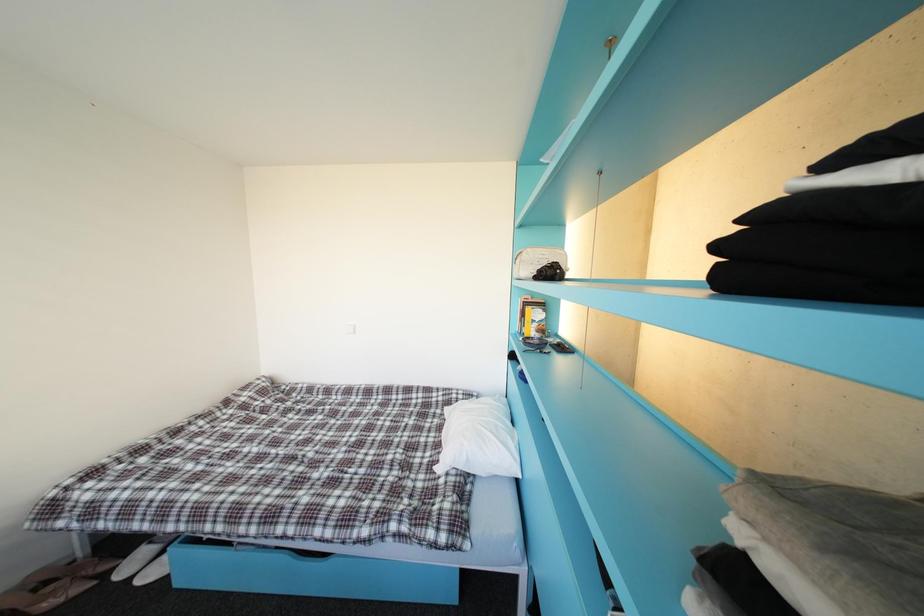
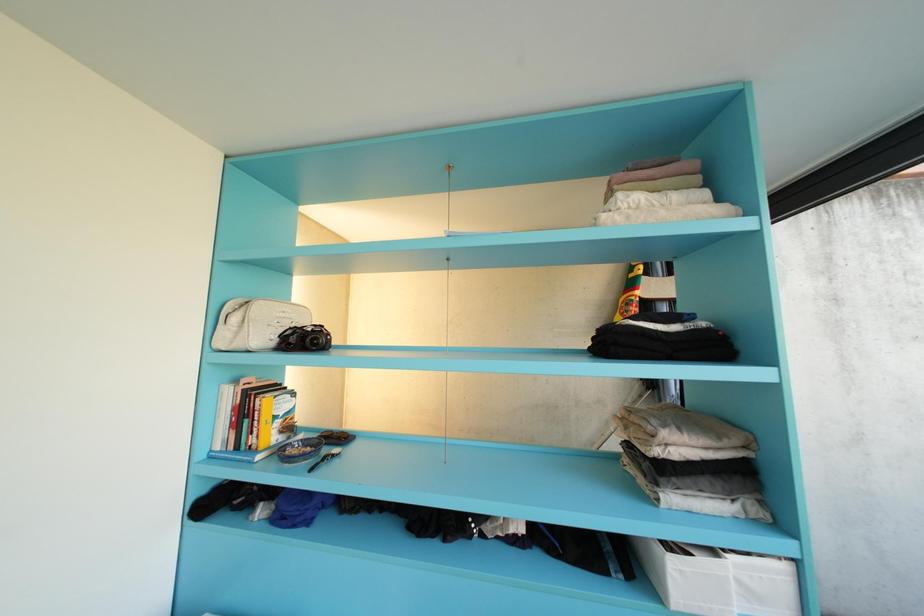
Question: How did the camera likely rotate?

Choices:
 (A) Left
 (B) Right
 (C) Up
 (D) Down

Answer: (B)